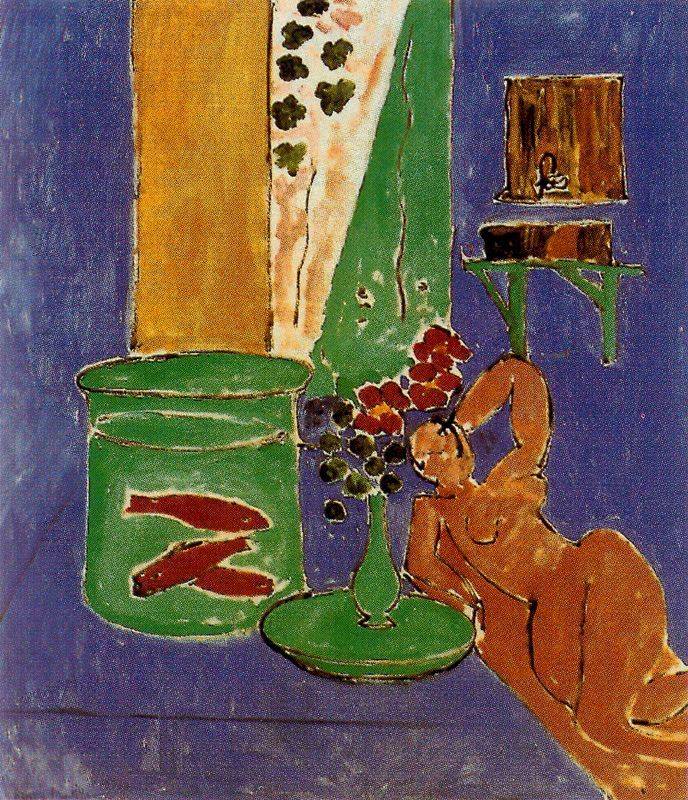
I want to click on green cup, so click(114, 482).